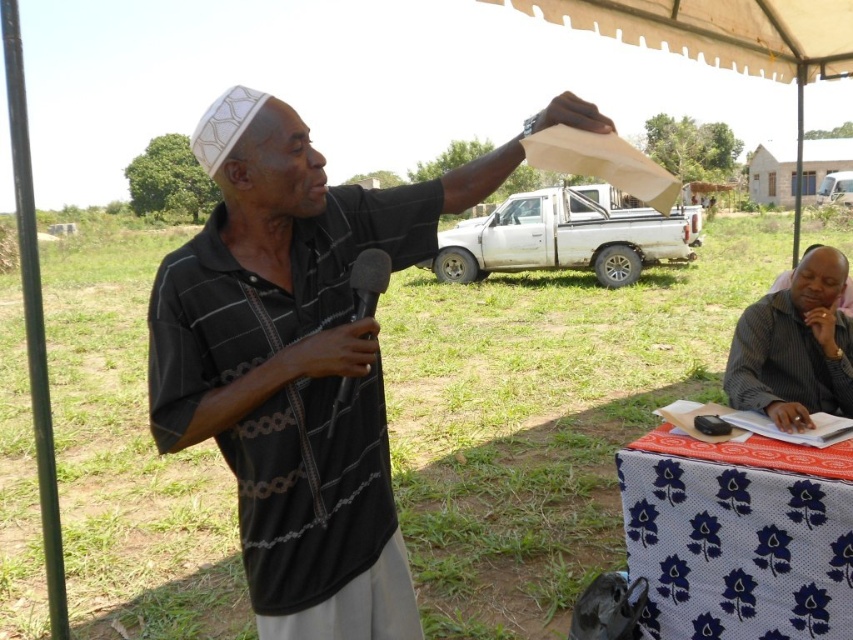
Between black matte microphone at center and dark gray striped shirt at center, which one has less height?

black matte microphone at center is shorter.

Can you confirm if black matte microphone at center is bigger than dark gray striped shirt at center?

Actually, black matte microphone at center might be smaller than dark gray striped shirt at center.

What do you see at coordinates (368, 280) in the screenshot?
I see `black matte microphone at center` at bounding box center [368, 280].

Locate an element on the screen. The image size is (853, 640). black matte microphone at center is located at coordinates (368, 280).

Which is more to the left, blue printed fabric table at lower right or black matte microphone at center?

black matte microphone at center

What are the coordinates of `blue printed fabric table at lower right` in the screenshot? It's located at (737, 538).

What do you see at coordinates (297, 371) in the screenshot?
I see `matte black shirt at center` at bounding box center [297, 371].

Which is behind, point (405, 189) or point (810, 448)?

The point (810, 448) is behind.

This screenshot has width=853, height=640. What are the coordinates of `matte black shirt at center` in the screenshot? It's located at (297, 371).